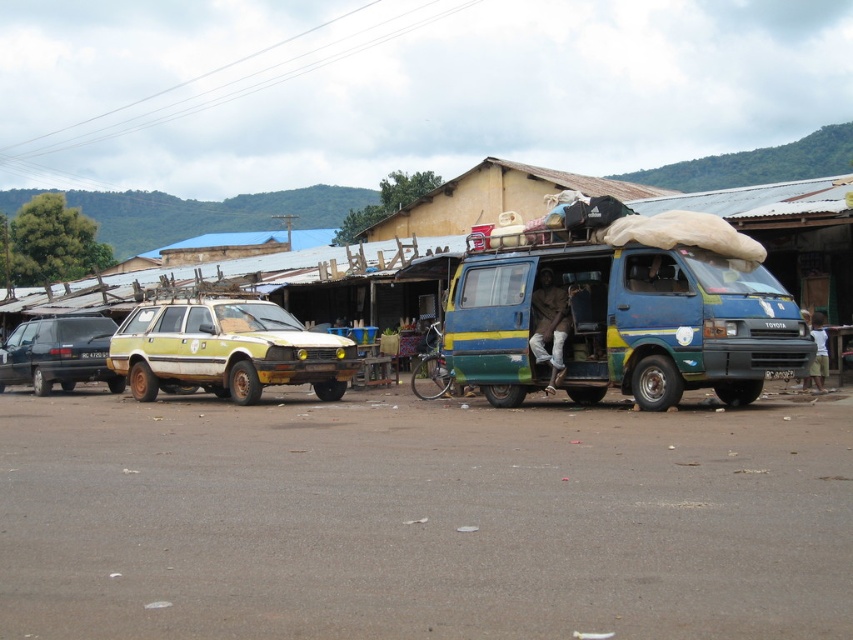
Who is positioned more to the left, dirty yellow car at left or matte black minivan at left?

matte black minivan at left is more to the left.

Is point (149, 392) behind point (103, 368)?

No, (149, 392) is in front of (103, 368).

Is point (231, 304) in front of point (45, 388)?

Yes, point (231, 304) is in front of point (45, 388).

Image resolution: width=853 pixels, height=640 pixels. In order to click on dirty yellow car at left in this screenshot , I will do `click(225, 349)`.

Is blue painted metal van at center below dirty yellow car at left?

No.

Who is more forward, [463,323] or [321,369]?

Point [463,323] is in front.

You are a GUI agent. You are given a task and a screenshot of the screen. Output one action in this format:
    pyautogui.click(x=<x>, y=<y>)
    Task: Click on the blue painted metal van at center
    The width and height of the screenshot is (853, 640).
    Given the screenshot: What is the action you would take?
    pyautogui.click(x=619, y=323)

Who is lower down, blue painted metal van at center or matte black minivan at left?

matte black minivan at left

Who is more forward, (463, 317) or (51, 321)?

Point (463, 317) is in front.

Does point (631, 262) lie in front of point (41, 349)?

Yes, point (631, 262) is closer to viewer.

Image resolution: width=853 pixels, height=640 pixels. Identify the location of blue painted metal van at center. (619, 323).